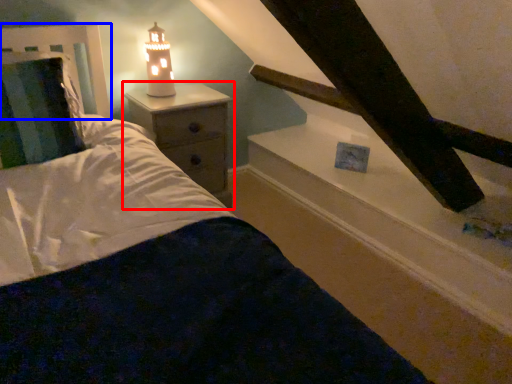
Question: Which object appears farthest to the camera in this image, nightstand (highlighted by a red box) or headboard (highlighted by a blue box)?

Choices:
 (A) nightstand
 (B) headboard

Answer: (A)